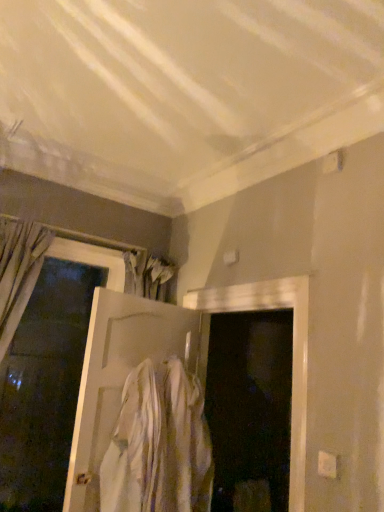
You are a GUI agent. You are given a task and a screenshot of the screen. Output one action in this format:
    pyautogui.click(x=<x>, y=<y>)
    Task: Click on the white matte door at center, the first door when ordered from right to left
    
    Given the screenshot: What is the action you would take?
    pyautogui.click(x=120, y=376)

This screenshot has height=512, width=384. What do you see at coordinates (120, 376) in the screenshot?
I see `white matte door at center, positioned as the second door in left-to-right order` at bounding box center [120, 376].

What are the coordinates of `white matte door at center, the first door when ordered from right to left` in the screenshot? It's located at (120, 376).

In the image, there is a white matte door at left, which ranks as the first door in left-to-right order. Where is `clothing below it (from the image's perspective)`? This screenshot has width=384, height=512. clothing below it (from the image's perspective) is located at coordinates (159, 444).

From the image's perspective, is white cotton shirt at center beneath white matte door at left, arranged as the second door when viewed from the right?

Correct, white cotton shirt at center appears lower than white matte door at left, arranged as the second door when viewed from the right, in the image.

Considering the relative positions of white cotton shirt at center and white matte door at left, arranged as the second door when viewed from the right, in the image provided, is white cotton shirt at center behind white matte door at left, arranged as the second door when viewed from the right,?

No.

Is point (174, 464) closer to viewer compared to point (16, 404)?

Yes, it is.

Considering the sizes of white matte door at left, arranged as the second door when viewed from the right, and white matte door at center, the first door when ordered from right to left, in the image, is white matte door at left, arranged as the second door when viewed from the right, taller or shorter than white matte door at center, the first door when ordered from right to left,?

Clearly, white matte door at left, arranged as the second door when viewed from the right, is taller compared to white matte door at center, the first door when ordered from right to left.

Would you say white matte door at left, which ranks as the first door in left-to-right order, is a long distance from white matte door at center, positioned as the second door in left-to-right order?

No, white matte door at left, which ranks as the first door in left-to-right order, is not far from white matte door at center, positioned as the second door in left-to-right order.

Based on the photo, is white matte door at left, arranged as the second door when viewed from the right, turned away from white matte door at center, positioned as the second door in left-to-right order?

No, white matte door at center, positioned as the second door in left-to-right order, is not at the back of white matte door at left, arranged as the second door when viewed from the right.

From the image's perspective, is white cotton shirt at center below white matte door at center, positioned as the second door in left-to-right order?

Indeed, from the image's perspective, white cotton shirt at center is shown beneath white matte door at center, positioned as the second door in left-to-right order.

How much distance is there between white cotton shirt at center and white matte door at center, positioned as the second door in left-to-right order?

white cotton shirt at center is 20.78 centimeters from white matte door at center, positioned as the second door in left-to-right order.

Which door is the 1st one when counting from the left side of the white cotton shirt at center? Please provide its 2D coordinates.

[(120, 376)]

Is white cotton shirt at center aimed at white matte door at center, positioned as the second door in left-to-right order?

No, white cotton shirt at center does not turn towards white matte door at center, positioned as the second door in left-to-right order.

Identify the location of door above the white matte door at center, the first door when ordered from right to left (from a real-world perspective). The width and height of the screenshot is (384, 512). (48, 376).

Between white matte door at center, the first door when ordered from right to left, and white matte door at left, arranged as the second door when viewed from the right, which one has larger width?

white matte door at left, arranged as the second door when viewed from the right.

Is white matte door at center, positioned as the second door in left-to-right order, situated inside white matte door at left, arranged as the second door when viewed from the right, or outside?

white matte door at center, positioned as the second door in left-to-right order, is outside white matte door at left, arranged as the second door when viewed from the right.

Could white cotton shirt at center be considered to be inside white matte door at left, arranged as the second door when viewed from the right?

No.

Where is `the 2nd door directly above the white cotton shirt at center (from a real-world perspective)`? The width and height of the screenshot is (384, 512). the 2nd door directly above the white cotton shirt at center (from a real-world perspective) is located at coordinates (48, 376).

From the image's perspective, is white matte door at left, which ranks as the first door in left-to-right order, located beneath white cotton shirt at center?

No.

Is white matte door at center, the first door when ordered from right to left, thinner than white cotton shirt at center?

Correct, the width of white matte door at center, the first door when ordered from right to left, is less than that of white cotton shirt at center.

From the picture: Considering the relative sizes of white matte door at center, the first door when ordered from right to left, and white cotton shirt at center in the image provided, is white matte door at center, the first door when ordered from right to left, shorter than white cotton shirt at center?

No.

Are white matte door at center, positioned as the second door in left-to-right order, and white cotton shirt at center beside each other?

white matte door at center, positioned as the second door in left-to-right order, and white cotton shirt at center are clearly separated.

Considering the positions of point (99, 407) and point (140, 456), is point (99, 407) closer or farther from the camera than point (140, 456)?

Point (99, 407).

Where is `clothing to the right of white matte door at left, which ranks as the first door in left-to-right order`? This screenshot has width=384, height=512. clothing to the right of white matte door at left, which ranks as the first door in left-to-right order is located at coordinates (159, 444).

Find the location of a particular element. This screenshot has height=512, width=384. door behind the white matte door at center, the first door when ordered from right to left is located at coordinates (48, 376).

Looking at the image, which one is located further to white cotton shirt at center, white matte door at center, positioned as the second door in left-to-right order, or white matte door at left, which ranks as the first door in left-to-right order?

white matte door at left, which ranks as the first door in left-to-right order, lies further to white cotton shirt at center than the other object.

Considering their positions, is white matte door at center, the first door when ordered from right to left, positioned closer to white matte door at left, which ranks as the first door in left-to-right order, than white cotton shirt at center?

white matte door at center, the first door when ordered from right to left, is closer to white matte door at left, which ranks as the first door in left-to-right order.

Which object lies nearer to the anchor point white matte door at left, which ranks as the first door in left-to-right order, white cotton shirt at center or white matte door at center, positioned as the second door in left-to-right order?

white matte door at center, positioned as the second door in left-to-right order, lies closer to white matte door at left, which ranks as the first door in left-to-right order, than the other object.

Estimate the real-world distances between objects in this image. Which object is closer to white matte door at center, positioned as the second door in left-to-right order, white matte door at left, which ranks as the first door in left-to-right order, or white cotton shirt at center?

white cotton shirt at center is closer to white matte door at center, positioned as the second door in left-to-right order.

Based on their spatial positions, is white matte door at left, which ranks as the first door in left-to-right order, or white matte door at center, the first door when ordered from right to left, closer to white cotton shirt at center?

white matte door at center, the first door when ordered from right to left, lies closer to white cotton shirt at center than the other object.

Estimate the real-world distances between objects in this image. Which object is closer to white matte door at center, the first door when ordered from right to left, white cotton shirt at center or white matte door at left, which ranks as the first door in left-to-right order?

The object closer to white matte door at center, the first door when ordered from right to left, is white cotton shirt at center.

Where is `door located between white matte door at left, which ranks as the first door in left-to-right order, and white cotton shirt at center in the left-right direction`? The height and width of the screenshot is (512, 384). door located between white matte door at left, which ranks as the first door in left-to-right order, and white cotton shirt at center in the left-right direction is located at coordinates (120, 376).